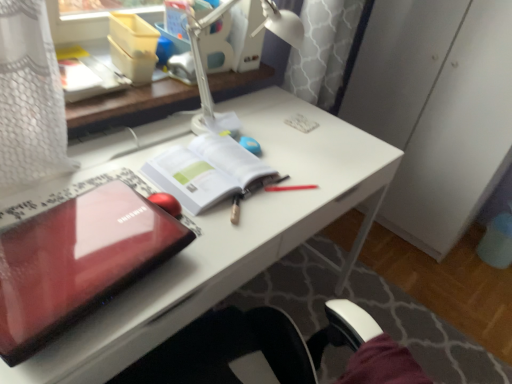
Identify the location of vacant area on top of glossy plastic laptop at left (from a real-world perspective). This screenshot has height=384, width=512. (74, 242).